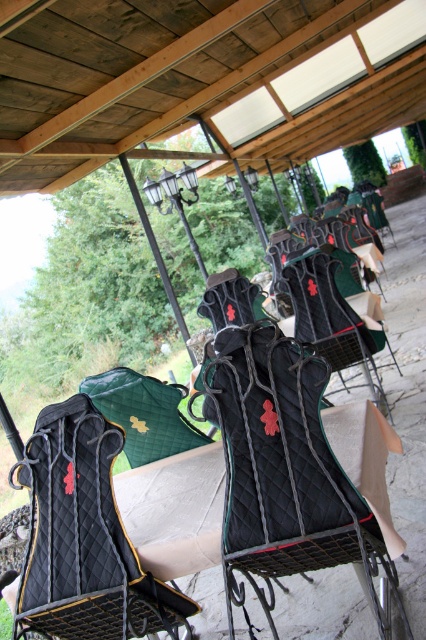
You are setting up a small seating area for a horse show event. You have two chairs available, the black quilted folding chair at center and the quilted black chair at center. If you want to choose the narrower one to save space, which chair should you pick?

The black quilted folding chair at center is thinner than the quilted black chair at center, so you should choose the black quilted folding chair at center to save space.

You are setting up a seating area for a small gathering. You have two chairs available in the scene. Which chair should you choose if you want a taller seat? Please select between the black quilted folding chair at center and the quilted black chair at center.

The quilted black chair at center is taller than the black quilted folding chair at center, so you should choose the quilted black chair at center for a taller seat.

You are setting up a small display in the middle of the area where the black quilted table at center and the quilted black chair at center are located. You need to place a decorative item that requires a wider base. Which object should you choose to place it on?

The quilted black chair at center has a wider base than the black quilted table at center, so you should place the decorative item on the quilted black chair at center.